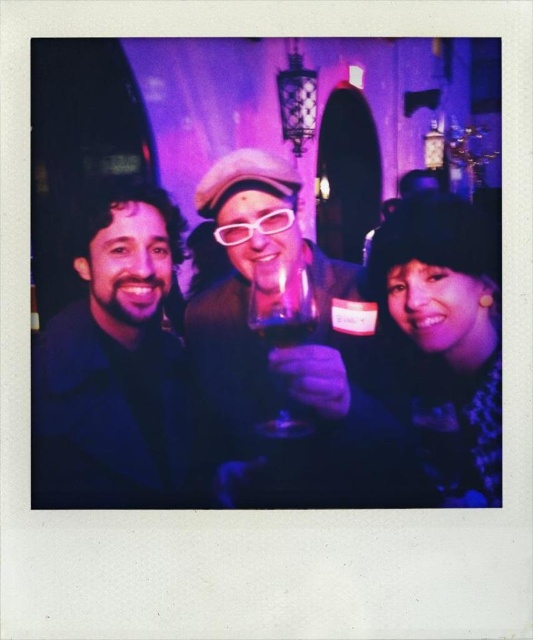
Question: Based on their relative distances, which object is nearer to the velvet black hat at right?

Choices:
 (A) matte plastic wine glass at center
 (B) translucent glass wine at center
 (C) matte black jacket at left

Answer: (A)

Question: Which object is closer to the camera taking this photo?

Choices:
 (A) matte black jacket at left
 (B) translucent glass wine at center
 (C) matte plastic wine glass at center
 (D) velvet black hat at right

Answer: (D)

Question: Estimate the real-world distances between objects in this image. Which object is closer to the translucent glass wine at center?

Choices:
 (A) matte plastic wine glass at center
 (B) matte black jacket at left

Answer: (A)

Question: Can you confirm if matte plastic wine glass at center is smaller than translucent glass wine at center?

Choices:
 (A) no
 (B) yes

Answer: (A)

Question: Where is matte plastic wine glass at center located in relation to velvet black hat at right in the image?

Choices:
 (A) above
 (B) below

Answer: (A)

Question: Is transparent glass at center wider than translucent glass wine at center?

Choices:
 (A) yes
 (B) no

Answer: (A)